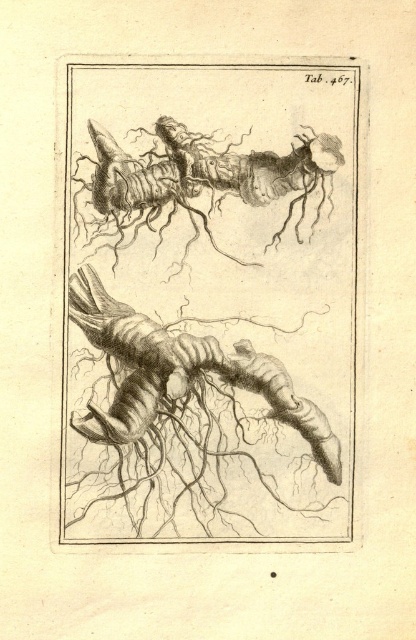
Based on the illustration labeled Tab. 467, which object at the center is wider, the etched wood roots at center or the smooth black insect at center?

The etched wood roots at center are wider than the smooth black insect at center according to the description.

You are a botanist examining the illustration. You need to place a 4.5 inch ruler between the etched wood roots at center and the smooth black insect at center. Will the ruler fit entirely between them without overlapping either object?

The distance between the etched wood roots at center and the smooth black insect at center is 3.79 inches. Since the ruler is 4.5 inches long, it will not fit entirely between them without overlapping because the ruler is longer than the space available.

In the scene shown: You are examining the illustration and want to determine which of the two points, point (272, 323) or point (329, 170), is closer to the viewer. Based on the illustration, which point is nearer?

Point (272, 323) is further to the camera than point (329, 170), so the point closer to the viewer is point (329, 170).